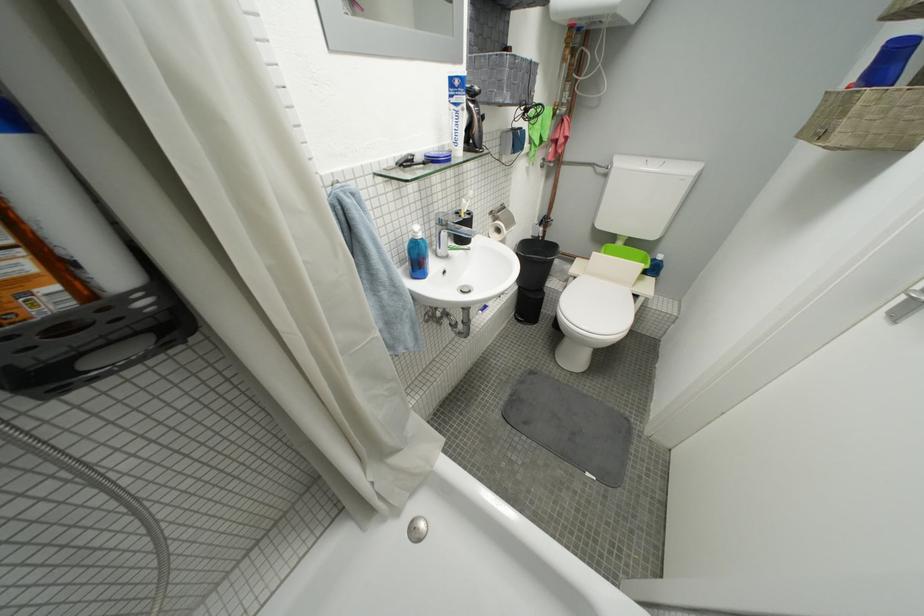
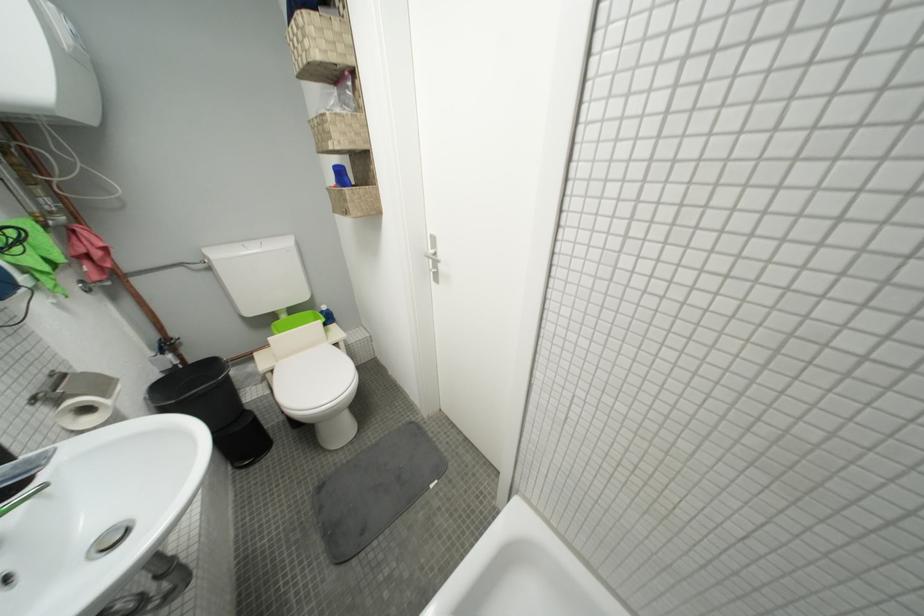
Locate, in the second image, the point that corresponds to the point at 831,138 in the first image.

(354, 216)